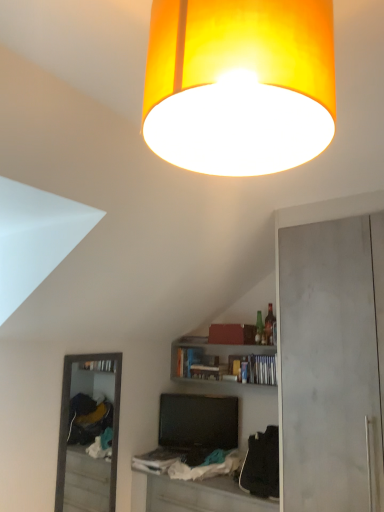
Question: Choose the correct answer: Is black glossy television at center inside wooden bookshelf at center or outside it?

Choices:
 (A) inside
 (B) outside

Answer: (B)

Question: Is point tap(195, 396) closer or farther from the camera than point tap(223, 352)?

Choices:
 (A) farther
 (B) closer

Answer: (B)

Question: Which of these objects is positioned closest to the white fabric table at lower center?

Choices:
 (A) orange fabric lampshade at upper center
 (B) wooden bookshelf at center
 (C) black glossy television at center

Answer: (C)

Question: Considering the real-world distances, which object is farthest from the white fabric table at lower center?

Choices:
 (A) orange fabric lampshade at upper center
 (B) black glossy television at center
 (C) wooden bookshelf at center

Answer: (A)